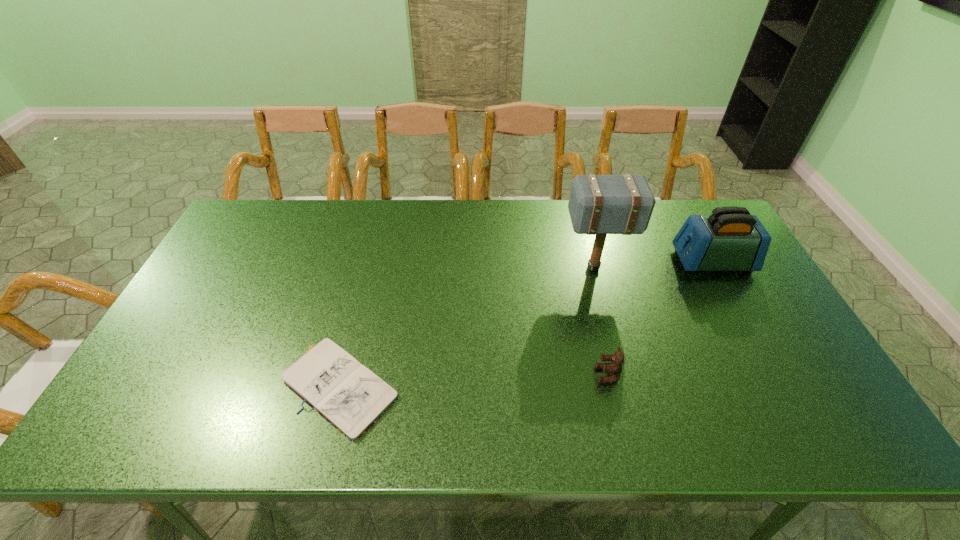
At what (x,y) coordinates should I click in order to perform the action: click on vacant area that lies between the third tallest object and the mallet. Please return your answer as a coordinate pair (x, y). Looking at the image, I should click on (601, 321).

The width and height of the screenshot is (960, 540). I want to click on free spot between the leftmost object and the rightmost object, so click(x=527, y=324).

Locate an element on the screen. This screenshot has width=960, height=540. vacant area that lies between the mallet and the third tallest object is located at coordinates (601, 321).

Choose which object is the third nearest neighbor to the second shortest object. Please provide its 2D coordinates. Your answer should be formatted as a tuple, i.e. [(x, y)], where the tuple contains the x and y coordinates of a point satisfying the conditions above.

[(347, 394)]

This screenshot has height=540, width=960. Find the location of `object that is the second closest to the rightmost object`. object that is the second closest to the rightmost object is located at coordinates (614, 368).

What are the coordinates of `vacant space that satisfies the following two spatial constraints: 1. on the striking surface of the mallet; 2. on the front side of the notebook` in the screenshot? It's located at (625, 386).